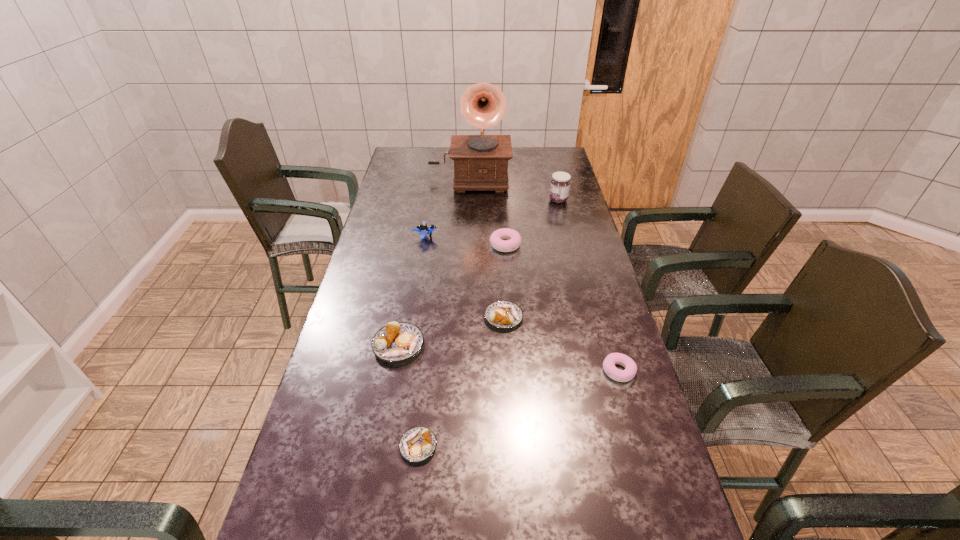
The image size is (960, 540). I want to click on blank area located 0.270m on the back of the left pink pastry, so click(x=502, y=199).

This screenshot has height=540, width=960. I want to click on vacant space located 0.080m on the left of the rightmost brown pastry, so click(458, 318).

I want to click on vacant space located on the front of the rightmost pastry, so click(643, 456).

You are a GUI agent. You are given a task and a screenshot of the screen. Output one action in this format:
    pyautogui.click(x=<x>, y=<y>)
    Task: Click on the vacant space situated on the front of the smallest brown pastry
    This screenshot has width=960, height=540.
    Given the screenshot: What is the action you would take?
    pyautogui.click(x=410, y=521)

Identify the location of object that is at the far edge. (480, 161).

At what (x,y) coordinates should I click in order to perform the action: click on object at the left edge. Please return your answer as a coordinate pair (x, y). Image resolution: width=960 pixels, height=540 pixels. Looking at the image, I should click on (397, 341).

At what (x,y) coordinates should I click in order to perform the action: click on jam that is positioned at the right edge. Please return your answer as a coordinate pair (x, y). The height and width of the screenshot is (540, 960). Looking at the image, I should click on (560, 183).

Find the location of `pastry located at the right edge`. pastry located at the right edge is located at coordinates (611, 360).

In the image, there is a desktop. Where is `vacant space at the far edge`? This screenshot has width=960, height=540. vacant space at the far edge is located at coordinates (434, 150).

Identify the location of free spot at the left edge of the desktop. The width and height of the screenshot is (960, 540). (399, 209).